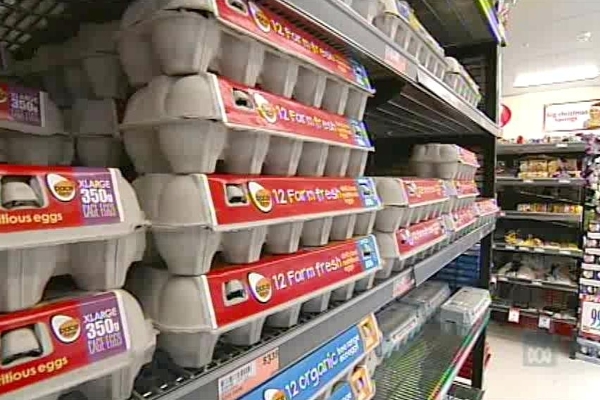
Locate an element on the screen. ceiling tiles is located at coordinates (551, 41).